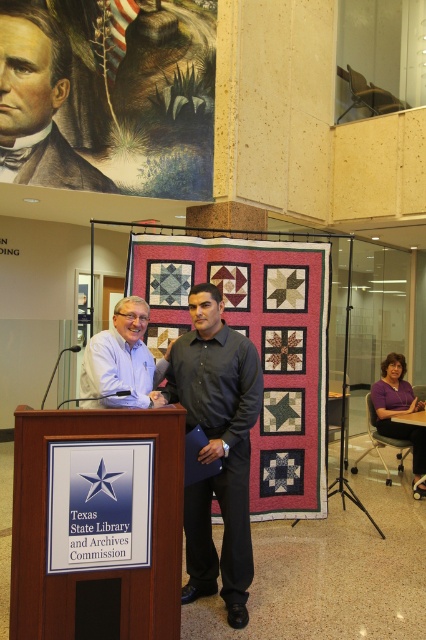
You are a photographer setting up for an event at the Texas State Library and Archives Commission. You need to position your camera so that both the wooden podium at center and the matte blue shirt at center are in frame. Considering their heights, which object should be placed closer to the camera to ensure both are fully visible?

The wooden podium at center is taller than the matte blue shirt at center. To ensure both are fully visible, position the camera so the wooden podium at center is closer to the camera while keeping the matte blue shirt at center slightly farther back. This way, the height difference is balanced, allowing both objects to fit within the frame.

You are an event organizer who needs to ensure that the two presenters at the podium are visible to the audience. Given that the black smooth shirt at center and the matte blue shirt at center are both standing at the center, which presenter should move slightly to the side to avoid blocking the other?

The black smooth shirt at center should move slightly to the side because its width is less than the matte blue shirt at center, making it easier to adjust without obstructing the view.